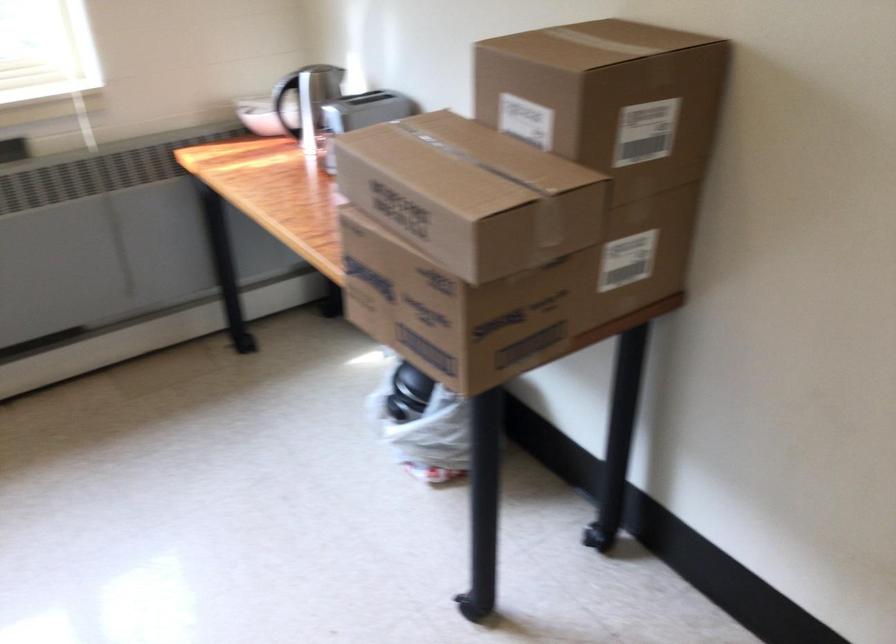
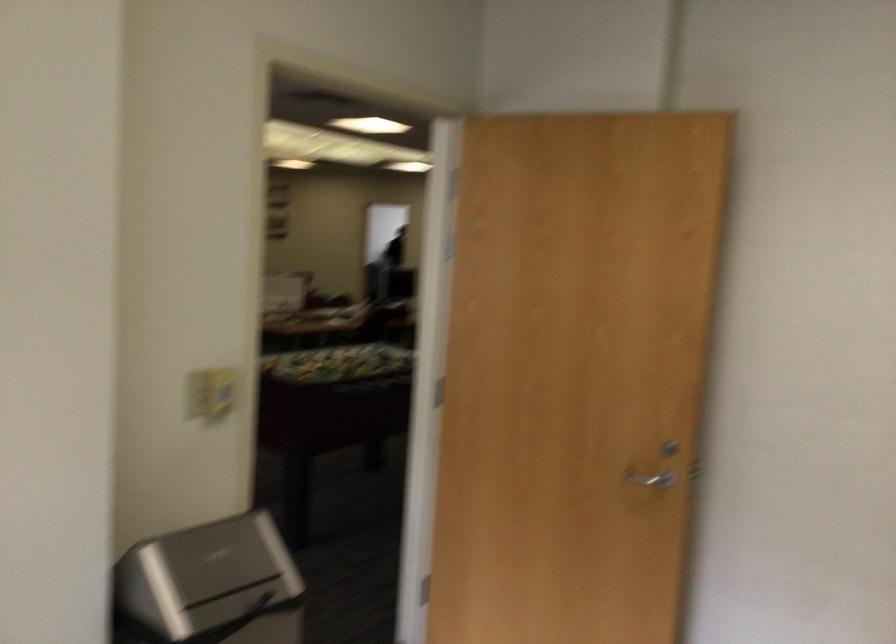
Based on the continuous images, in which direction is the camera rotating?

The rotation direction of the camera is right-down.